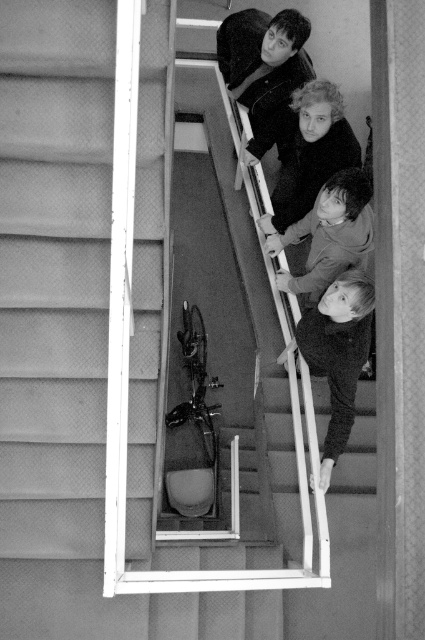
Who is shorter, smooth black shirt at upper center or smooth black shirt at lower right?

smooth black shirt at upper center is shorter.

Is point (280, 13) farther from camera compared to point (346, 417)?

Yes, point (280, 13) is farther from viewer.

This screenshot has height=640, width=425. Find the location of `smooth black shirt at upper center`. smooth black shirt at upper center is located at coordinates (265, 70).

Does smooth black shirt at upper center appear on the left side of smooth skin child at upper center?

Yes, smooth black shirt at upper center is to the left of smooth skin child at upper center.

Between point (274, 80) and point (280, 196), which one is positioned in front?

Point (274, 80) is in front.

Between point (243, 74) and point (302, 164), which one is positioned in front?

Point (302, 164)

Locate an element on the screen. This screenshot has width=425, height=640. smooth black shirt at upper center is located at coordinates (265, 70).

Can you confirm if smooth black shirt at lower right is positioned above smooth skin child at upper center?

No.

Between point (350, 310) and point (322, 172), which one is positioned in front?

Point (350, 310) is more forward.

The width and height of the screenshot is (425, 640). Identify the location of smooth black shirt at lower right. (337, 353).